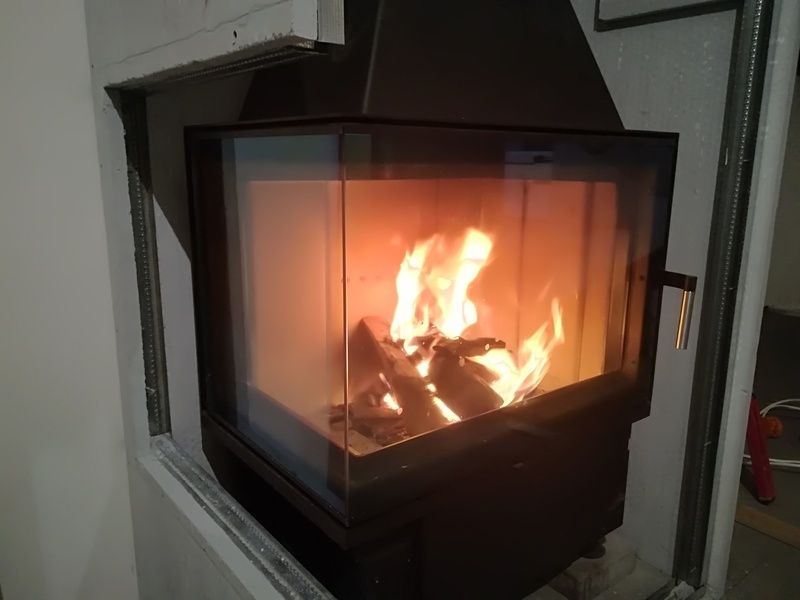
The image size is (800, 600). I want to click on heater leg, so click(x=594, y=550).